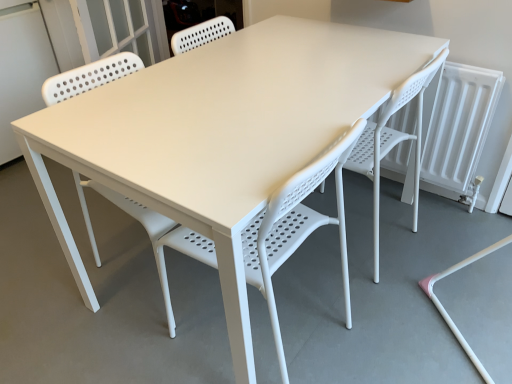
Question: Could you tell me if white plastic chair at center, which appears as the second chair when viewed from the right, is turned towards white plastic chair at center, which is counted as the 1th chair, starting from the right?

Choices:
 (A) no
 (B) yes

Answer: (A)

Question: From the image's perspective, does white plastic chair at center, which appears as the second chair when viewed from the right, appear higher than white plastic chair at center, which is counted as the 1th chair, starting from the right?

Choices:
 (A) yes
 (B) no

Answer: (B)

Question: Does white plastic chair at center, which appears as the second chair when viewed from the right, have a lesser height compared to white plastic chair at center, which is counted as the 1th chair, starting from the right?

Choices:
 (A) yes
 (B) no

Answer: (A)

Question: Is white plastic chair at center, which appears as the second chair when viewed from the right, behind white plastic chair at center, which appears as the second chair when viewed from the left?

Choices:
 (A) no
 (B) yes

Answer: (A)

Question: Does white plastic chair at center, the 1th chair positioned from the left, have a larger size compared to white plastic chair at center, which is counted as the 1th chair, starting from the right?

Choices:
 (A) yes
 (B) no

Answer: (B)

Question: From the image's perspective, is white plastic chair at center, the 1th chair positioned from the left, positioned above or below white plastic screen door at upper left?

Choices:
 (A) below
 (B) above

Answer: (A)

Question: Is white plastic chair at center, the 1th chair positioned from the left, taller or shorter than white plastic screen door at upper left?

Choices:
 (A) tall
 (B) short

Answer: (B)

Question: Would you say white plastic chair at center, which appears as the second chair when viewed from the right, is inside or outside white plastic screen door at upper left?

Choices:
 (A) inside
 (B) outside

Answer: (B)

Question: In terms of width, does white plastic chair at center, which appears as the second chair when viewed from the right, look wider or thinner when compared to white plastic screen door at upper left?

Choices:
 (A) wide
 (B) thin

Answer: (B)

Question: Considering the relative positions of white plastic screen door at upper left and white plastic chair at center, which appears as the second chair when viewed from the right, in the image provided, is white plastic screen door at upper left to the left or to the right of white plastic chair at center, which appears as the second chair when viewed from the right,?

Choices:
 (A) left
 (B) right

Answer: (A)

Question: From a real-world perspective, is white plastic screen door at upper left physically located above or below white plastic chair at center, the 1th chair positioned from the left?

Choices:
 (A) above
 (B) below

Answer: (A)

Question: Relative to white plastic chair at center, which appears as the second chair when viewed from the right, is white plastic screen door at upper left in front or behind?

Choices:
 (A) behind
 (B) front

Answer: (A)

Question: From the image's perspective, is white plastic screen door at upper left located above or below white plastic chair at center, which appears as the second chair when viewed from the right?

Choices:
 (A) below
 (B) above

Answer: (B)

Question: Is white plastic chair at center, which is counted as the 1th chair, starting from the right, inside or outside of white plastic chair at center, the 1th chair positioned from the left?

Choices:
 (A) inside
 (B) outside

Answer: (B)

Question: Considering their positions, is white plastic chair at center, which is counted as the 1th chair, starting from the right, located in front of or behind white plastic chair at center, the 1th chair positioned from the left?

Choices:
 (A) front
 (B) behind

Answer: (B)